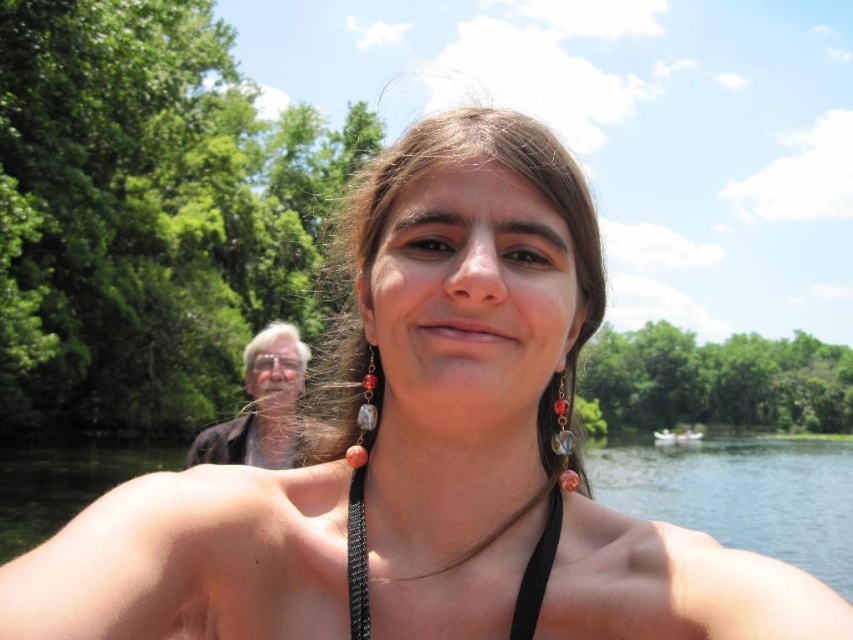
You are a photographer trying to capture a clear shot of the black mesh bikini top at center and the white plastic boat at lower right. Since you want both subjects in focus, which one should you adjust your camera focus on first?

The black mesh bikini top at center is closer to the viewer than the white plastic boat at lower right, so you should focus on the black mesh bikini top at center first to ensure both are in focus.

You are a photographer trying to capture the reflection of the black mesh bikini top at center in the clear water at center. Based on the scene, can you determine if the reflection will be visible?

The clear water at center is taller than the black mesh bikini top at center, so the reflection of the black mesh bikini top at center may be visible in the clear water at center depending on the angle and clarity of the water.

You are planning to take a photo of the black mesh bikini top at center and the white plastic boat at lower right. Which object is narrower in width?

The black mesh bikini top at center is narrower in width compared to the white plastic boat at lower right.